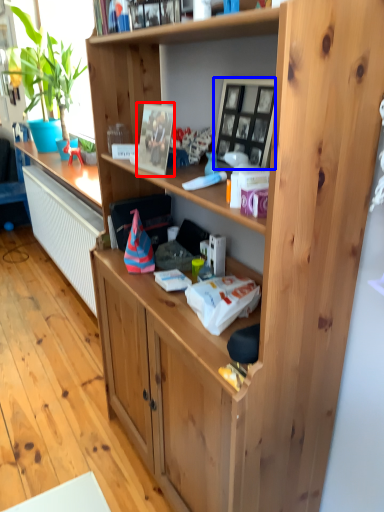
Question: Which object is closer to the camera taking this photo, picture frame (highlighted by a red box) or picture frame (highlighted by a blue box)?

Choices:
 (A) picture frame
 (B) picture frame

Answer: (B)